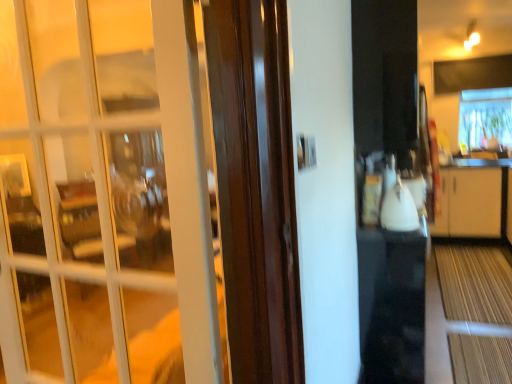
Question: Considering the relative sizes of white glass door at left and white glossy kettle at center in the image provided, is white glass door at left thinner than white glossy kettle at center?

Choices:
 (A) yes
 (B) no

Answer: (A)

Question: Considering the relative sizes of white glass door at left and white glossy kettle at center in the image provided, is white glass door at left shorter than white glossy kettle at center?

Choices:
 (A) no
 (B) yes

Answer: (A)

Question: From the image's perspective, would you say white glass door at left is shown under white glossy kettle at center?

Choices:
 (A) no
 (B) yes

Answer: (B)

Question: From a real-world perspective, is white glass door at left physically below white glossy kettle at center?

Choices:
 (A) yes
 (B) no

Answer: (B)

Question: Does white glass door at left have a smaller size compared to white glossy kettle at center?

Choices:
 (A) no
 (B) yes

Answer: (A)

Question: Is white glossy kettle at center bigger or smaller than transparent plastic window at upper right?

Choices:
 (A) small
 (B) big

Answer: (A)

Question: Considering their positions, is white glossy kettle at center located in front of or behind transparent plastic window at upper right?

Choices:
 (A) front
 (B) behind

Answer: (A)

Question: From the image's perspective, is white glossy kettle at center above or below transparent plastic window at upper right?

Choices:
 (A) above
 (B) below

Answer: (B)

Question: Does point (381, 215) appear closer or farther from the camera than point (466, 142)?

Choices:
 (A) closer
 (B) farther

Answer: (A)

Question: Based on their sizes in the image, would you say white glass door at left is bigger or smaller than transparent plastic window at upper right?

Choices:
 (A) small
 (B) big

Answer: (A)

Question: Considering the relative positions of white glass door at left and transparent plastic window at upper right in the image provided, is white glass door at left to the left or to the right of transparent plastic window at upper right?

Choices:
 (A) left
 (B) right

Answer: (A)

Question: Is white glass door at left taller or shorter than transparent plastic window at upper right?

Choices:
 (A) tall
 (B) short

Answer: (A)

Question: Is point (151, 249) positioned closer to the camera than point (487, 135)?

Choices:
 (A) closer
 (B) farther

Answer: (A)

Question: From the image's perspective, is transparent plastic window at upper right positioned above or below white glass door at left?

Choices:
 (A) above
 (B) below

Answer: (A)

Question: In terms of width, does transparent plastic window at upper right look wider or thinner when compared to white glass door at left?

Choices:
 (A) thin
 (B) wide

Answer: (B)